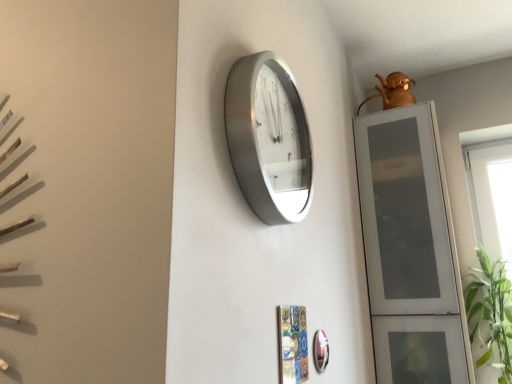
Question: Can you confirm if transparent glass window at right is positioned to the left of shiny silver mirror at lower center?

Choices:
 (A) yes
 (B) no

Answer: (B)

Question: From the image's perspective, is transparent glass window at right beneath shiny silver mirror at lower center?

Choices:
 (A) no
 (B) yes

Answer: (A)

Question: Considering the relative sizes of transparent glass window at right and shiny silver mirror at lower center in the image provided, is transparent glass window at right bigger than shiny silver mirror at lower center?

Choices:
 (A) yes
 (B) no

Answer: (A)

Question: Is the surface of transparent glass window at right in direct contact with shiny silver mirror at lower center?

Choices:
 (A) no
 (B) yes

Answer: (A)

Question: Is transparent glass window at right facing away from shiny silver mirror at lower center?

Choices:
 (A) no
 (B) yes

Answer: (A)

Question: From a real-world perspective, relative to transparent glass window at right, is transparent glass cabinet at right vertically above or below?

Choices:
 (A) below
 (B) above

Answer: (B)

Question: Would you say transparent glass cabinet at right is inside or outside transparent glass window at right?

Choices:
 (A) outside
 (B) inside

Answer: (A)

Question: Is point (366, 185) closer or farther from the camera than point (498, 263)?

Choices:
 (A) closer
 (B) farther

Answer: (A)

Question: From the image's perspective, relative to transparent glass window at right, is transparent glass cabinet at right above or below?

Choices:
 (A) above
 (B) below

Answer: (A)

Question: From the image's perspective, relative to satin silver clock at center, is shiny silver mirror at lower center above or below?

Choices:
 (A) above
 (B) below

Answer: (B)

Question: Considering the positions of point (321, 364) and point (287, 92), is point (321, 364) closer or farther from the camera than point (287, 92)?

Choices:
 (A) closer
 (B) farther

Answer: (B)

Question: From a real-world perspective, is shiny silver mirror at lower center positioned above or below satin silver clock at center?

Choices:
 (A) below
 (B) above

Answer: (A)

Question: From their relative heights in the image, would you say shiny silver mirror at lower center is taller or shorter than satin silver clock at center?

Choices:
 (A) tall
 (B) short

Answer: (B)

Question: In terms of height, does satin silver clock at center look taller or shorter compared to transparent glass window at right?

Choices:
 (A) short
 (B) tall

Answer: (A)

Question: Do you think satin silver clock at center is within transparent glass window at right, or outside of it?

Choices:
 (A) outside
 (B) inside

Answer: (A)